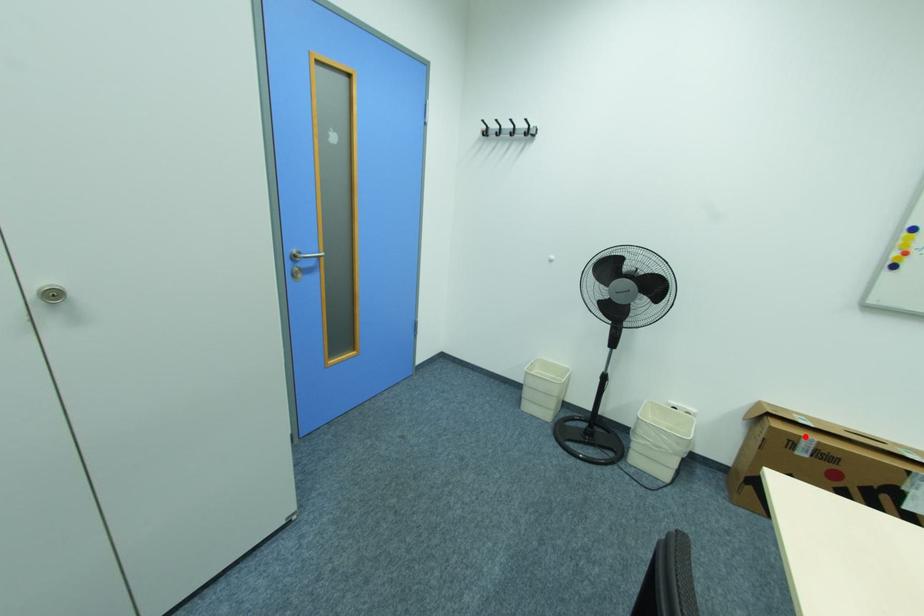
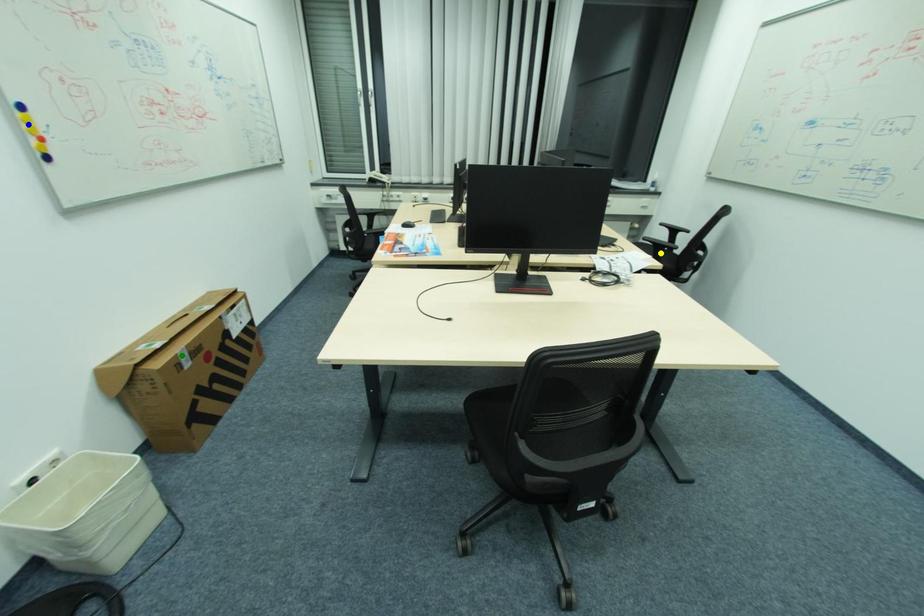
Question: I am providing you with two images of the same scene from different viewpoints. A red point is marked on the first image. You are given multiple points on the second image. Which point in image 2 is actually the same real-world point as the red point in image 1?

Choices:
 (A) blue point
 (B) green point
 (C) yellow point

Answer: (B)